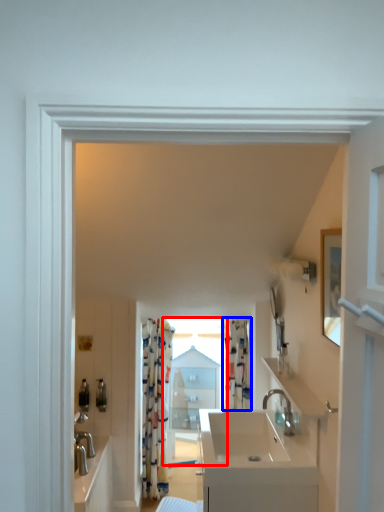
Question: Which object appears farthest to the camera in this image, window (highlighted by a red box) or curtain (highlighted by a blue box)?

Choices:
 (A) window
 (B) curtain

Answer: (A)